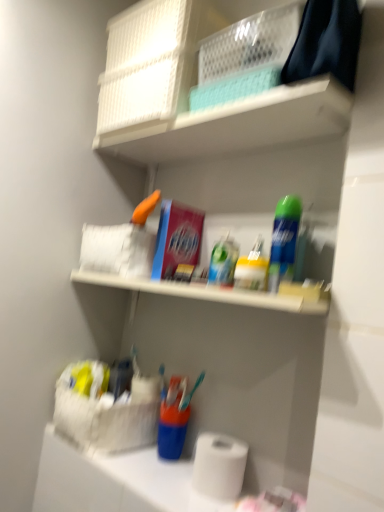
Question: Is translucent plastic toothpaste at center, which ranks as the second toiletry in right-to-left order, behind translucent plastic container at center, which is the second toiletry from left to right?

Choices:
 (A) yes
 (B) no

Answer: (A)

Question: Is translucent plastic toothpaste at center, which ranks as the second toiletry in right-to-left order, smaller than translucent plastic container at center, which is the second toiletry from left to right?

Choices:
 (A) no
 (B) yes

Answer: (B)

Question: Is translucent plastic toothpaste at center, the first toiletry viewed from the left, not within translucent plastic container at center, which is the first toiletry in right-to-left order?

Choices:
 (A) no
 (B) yes

Answer: (B)

Question: From a real-world perspective, is translucent plastic toothpaste at center, which ranks as the second toiletry in right-to-left order, positioned over translucent plastic container at center, which is the second toiletry from left to right, based on gravity?

Choices:
 (A) no
 (B) yes

Answer: (B)

Question: Is translucent plastic toothpaste at center, which ranks as the second toiletry in right-to-left order, looking in the opposite direction of translucent plastic container at center, which is the second toiletry from left to right?

Choices:
 (A) no
 (B) yes

Answer: (A)

Question: In terms of width, does white matte paper towel at lower center look wider or thinner when compared to white mesh basket at upper center?

Choices:
 (A) wide
 (B) thin

Answer: (A)

Question: Is white matte paper towel at lower center to the left or to the right of white mesh basket at upper center in the image?

Choices:
 (A) right
 (B) left

Answer: (B)

Question: Considering their positions, is white matte paper towel at lower center located in front of or behind white mesh basket at upper center?

Choices:
 (A) front
 (B) behind

Answer: (A)

Question: From the image's perspective, is white matte paper towel at lower center located above or below white mesh basket at upper center?

Choices:
 (A) below
 (B) above

Answer: (A)

Question: Based on their positions, is translucent plastic toothpaste at center, which ranks as the second toiletry in right-to-left order, located to the left or right of white matte toilet paper at lower center?

Choices:
 (A) right
 (B) left

Answer: (A)

Question: Would you say translucent plastic toothpaste at center, which ranks as the second toiletry in right-to-left order, is inside or outside white matte toilet paper at lower center?

Choices:
 (A) inside
 (B) outside

Answer: (B)

Question: Looking at the image, does translucent plastic toothpaste at center, the first toiletry viewed from the left, seem bigger or smaller compared to white matte toilet paper at lower center?

Choices:
 (A) big
 (B) small

Answer: (B)

Question: From a real-world perspective, is translucent plastic toothpaste at center, the first toiletry viewed from the left, positioned above or below white matte toilet paper at lower center?

Choices:
 (A) above
 (B) below

Answer: (A)

Question: Based on their sizes in the image, would you say translucent plastic toothpaste at center, the first toiletry viewed from the left, is bigger or smaller than white mesh basket at upper center?

Choices:
 (A) big
 (B) small

Answer: (B)

Question: From the image's perspective, relative to white mesh basket at upper center, is translucent plastic toothpaste at center, the first toiletry viewed from the left, above or below?

Choices:
 (A) below
 (B) above

Answer: (A)